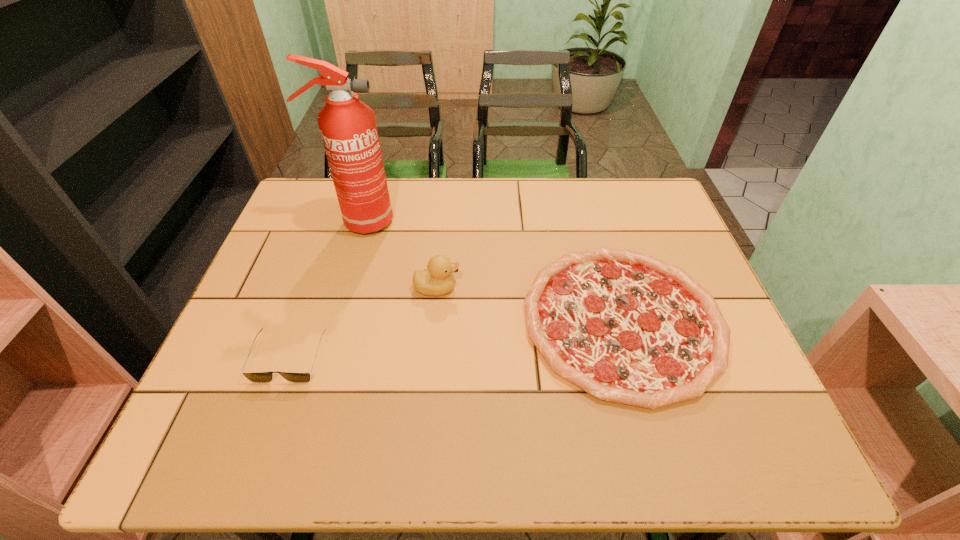
Where is `object that is the third closest to the second shortest object`? The height and width of the screenshot is (540, 960). object that is the third closest to the second shortest object is located at coordinates (626, 327).

In order to click on object that is the second nearest to the duckling in this screenshot , I will do `click(348, 128)`.

Locate an element on the screen. This screenshot has height=540, width=960. vacant point that satisfies the following two spatial constraints: 1. at the nozzle of the tallest object; 2. on the front-facing side of the sunglasses is located at coordinates (319, 357).

This screenshot has width=960, height=540. I want to click on free space that satisfies the following two spatial constraints: 1. on the face of the rightmost object; 2. on the right side of the third shortest object, so click(434, 320).

Image resolution: width=960 pixels, height=540 pixels. Find the location of `free space that satisfies the following two spatial constraints: 1. on the back side of the shortest object; 2. at the nozzle of the farthest object`. free space that satisfies the following two spatial constraints: 1. on the back side of the shortest object; 2. at the nozzle of the farthest object is located at coordinates (594, 222).

Where is `free location that satisfies the following two spatial constraints: 1. at the nozzle of the pizza; 2. on the right side of the farthest object`? The width and height of the screenshot is (960, 540). free location that satisfies the following two spatial constraints: 1. at the nozzle of the pizza; 2. on the right side of the farthest object is located at coordinates (330, 320).

Where is `vacant space that satisfies the following two spatial constraints: 1. on the face of the shortest object; 2. on the left side of the duckling`? This screenshot has height=540, width=960. vacant space that satisfies the following two spatial constraints: 1. on the face of the shortest object; 2. on the left side of the duckling is located at coordinates (434, 320).

Where is `vacant area in the image that satisfies the following two spatial constraints: 1. at the nozzle of the tallest object; 2. on the front-facing side of the second shortest object`? The height and width of the screenshot is (540, 960). vacant area in the image that satisfies the following two spatial constraints: 1. at the nozzle of the tallest object; 2. on the front-facing side of the second shortest object is located at coordinates (319, 357).